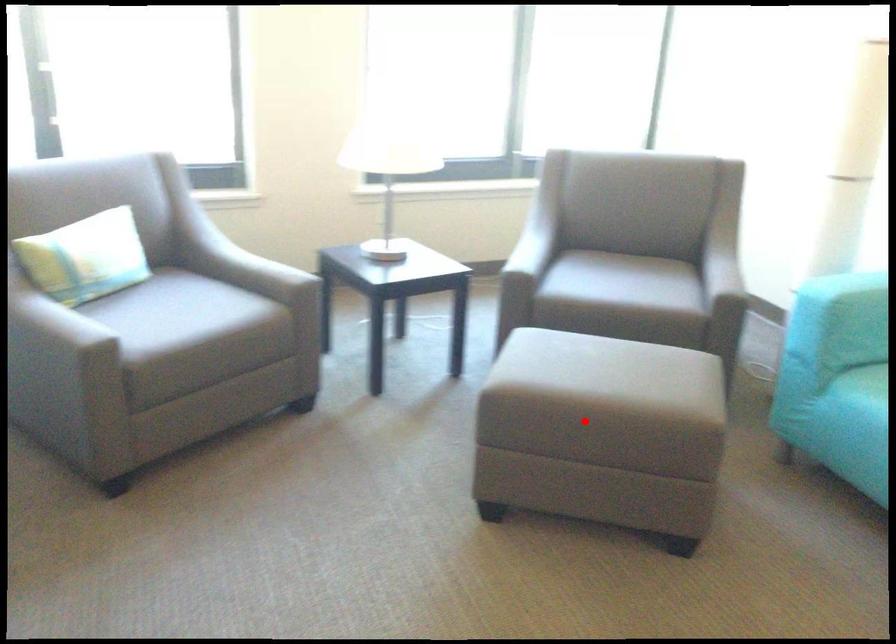
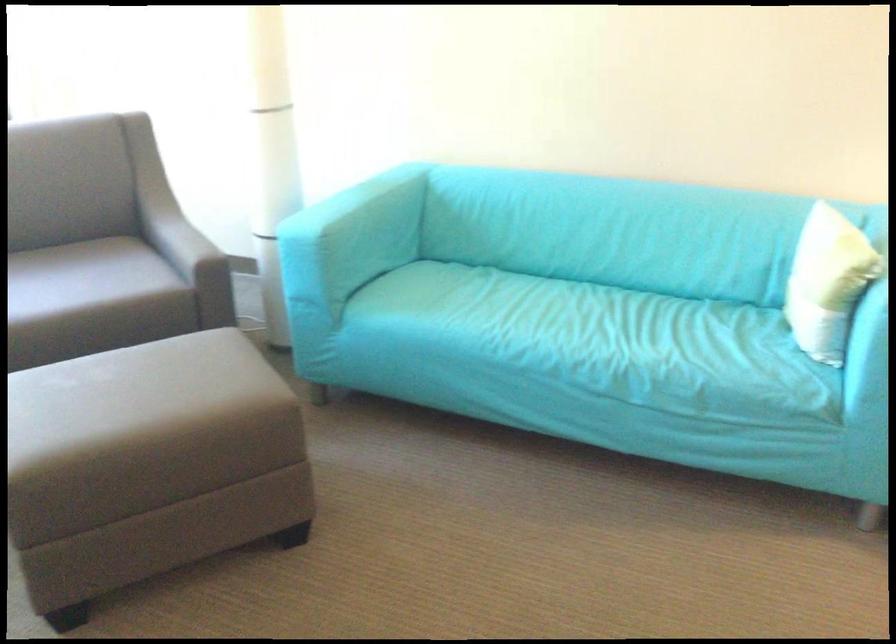
Question: I am providing you with two images of the same scene from different viewpoints. Image1 has a red point marked. In image2, the corresponding 3D location appears at what relative position? Reply with the corresponding letter.

Choices:
 (A) Closer
 (B) Farther

Answer: (A)